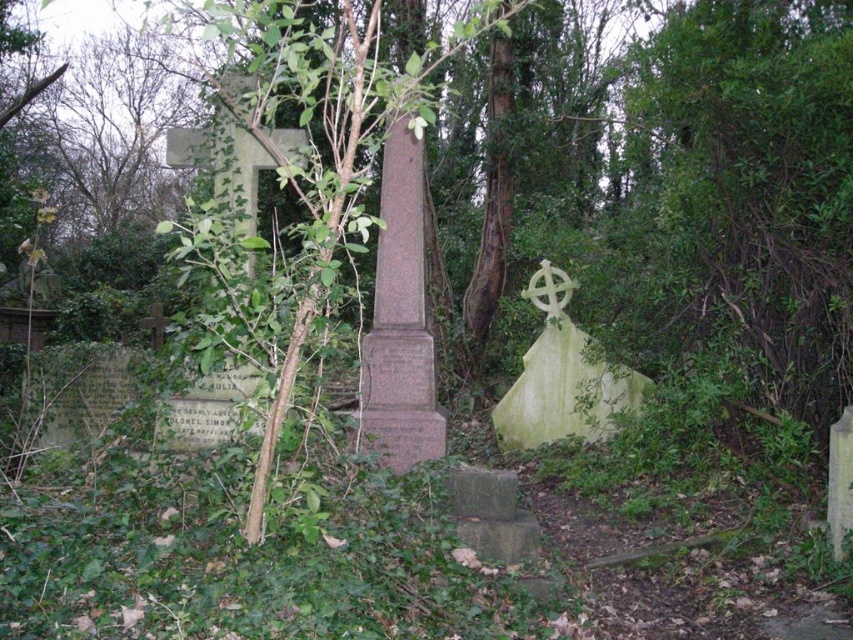
You are a gardener trying to prune the green leafy tree at center so it doesn not block the white stone cross at center right. Can you tell me if the tree is wider than the cross?

The green leafy tree at center might be wider than white stone cross at center right according to the description.

You are standing at point 0.2, 0.38 in the cemetery. You want to walk towards the green leafy tree at center. Which direction should you go?

The green leafy tree at center is located at point (322, 124). Since you are at point (323, 128), you are very close to the tree and can walk directly towards it as your current position is nearly aligned with its coordinates.

You are standing at the entrance of the cemetery and see the point marked as point (322, 124). What object does this point correspond to in the scene?

The point (322, 124) corresponds to the green leafy tree at center.